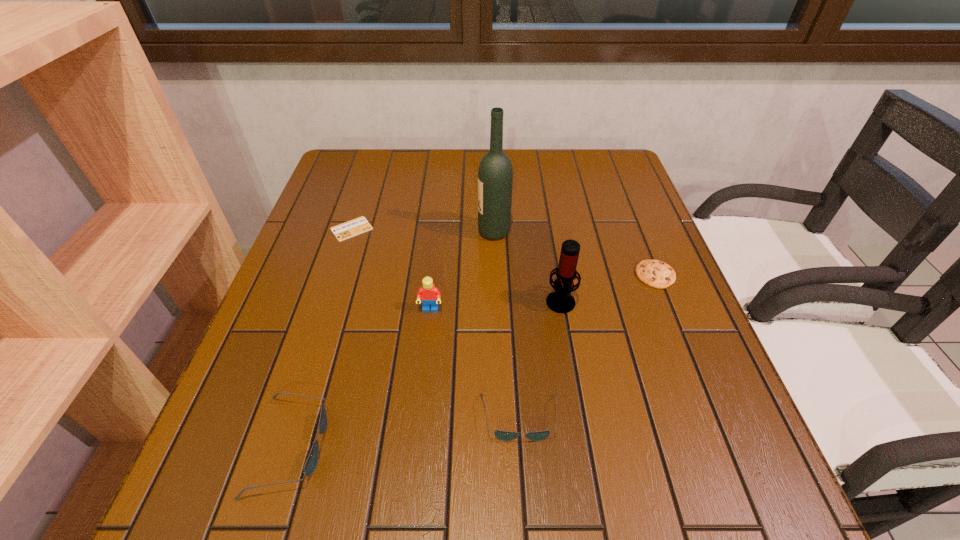
All sunglassess are currently evenly spaced. To continue this pattern, where would you add another sunglasses on the right? Please point out a vacant spot. Please provide its 2D coordinates. Your answer should be formatted as a tuple, i.e. [(x, y)], where the tuple contains the x and y coordinates of a point satisfying the conditions above.

[(730, 393)]